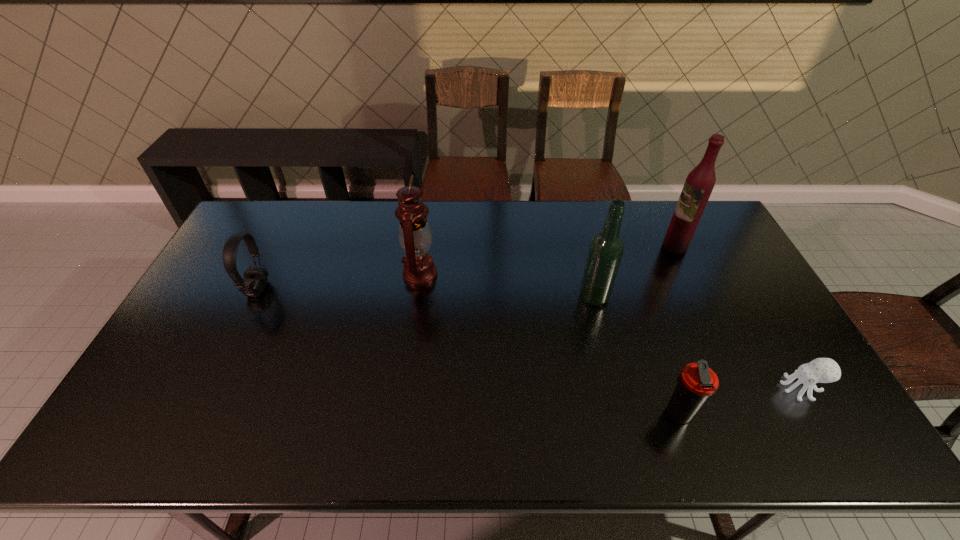
The image size is (960, 540). Find the location of `vacant area that lies between the leftmost object and the third object from left to right`. vacant area that lies between the leftmost object and the third object from left to right is located at coordinates (426, 293).

Locate an element on the screen. The width and height of the screenshot is (960, 540). free space between the second object from left to right and the third object from left to right is located at coordinates (507, 285).

I want to click on vacant space that's between the second object from right to left and the fifth object from right to left, so click(x=547, y=260).

Find the location of a particular element. blank region between the shortest object and the farther liquor is located at coordinates (738, 317).

Locate an element on the screen. Image resolution: width=960 pixels, height=540 pixels. free point between the nearer liquor and the second object from right to left is located at coordinates (635, 271).

Locate an element on the screen. This screenshot has width=960, height=540. vacant area that lies between the leftmost object and the third object from right to left is located at coordinates (468, 352).

The width and height of the screenshot is (960, 540). I want to click on unoccupied position between the rightmost object and the thermos bottle, so click(739, 401).

Locate an element on the screen. free space that is in between the headset and the right liquor is located at coordinates (467, 267).

Where is `vacant point located between the right liquor and the rightmost object`? The image size is (960, 540). vacant point located between the right liquor and the rightmost object is located at coordinates (738, 317).

This screenshot has width=960, height=540. In order to click on free spot between the second object from right to left and the third object from left to right in this screenshot , I will do `click(635, 271)`.